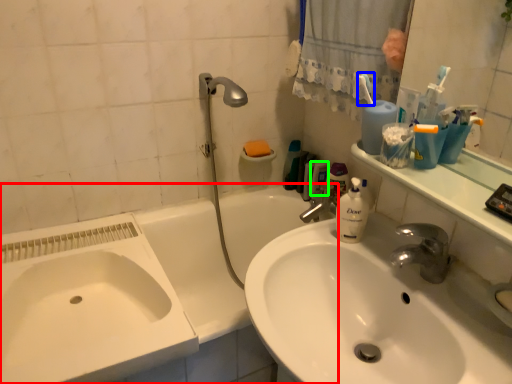
Question: Considering the real-world distances, which object is farthest from bathtub (highlighted by a red box)? toothbrush (highlighted by a blue box) or mouthwash (highlighted by a green box)?

Choices:
 (A) toothbrush
 (B) mouthwash

Answer: (A)